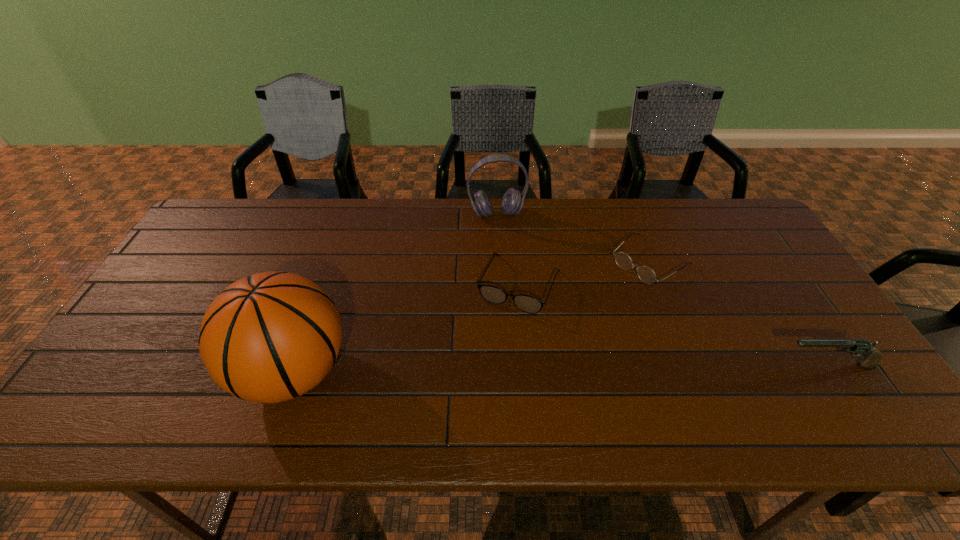
Locate an element on the screen. The image size is (960, 540). vacant space located aiming along the barrel of the third shortest object is located at coordinates (752, 365).

Find the location of a particular element. free space located 0.370m aiming along the barrel of the third shortest object is located at coordinates (627, 365).

This screenshot has width=960, height=540. Find the location of `vacant region located 0.110m aiming along the barrel of the third shortest object`. vacant region located 0.110m aiming along the barrel of the third shortest object is located at coordinates (734, 365).

Where is `vacant space located through the lenses of the right spectacles`? The height and width of the screenshot is (540, 960). vacant space located through the lenses of the right spectacles is located at coordinates (583, 314).

Where is `free spot located 0.120m through the lenses of the right spectacles`? This screenshot has width=960, height=540. free spot located 0.120m through the lenses of the right spectacles is located at coordinates (601, 300).

Where is `vacant area situated 0.400m through the lenses of the right spectacles`? The image size is (960, 540). vacant area situated 0.400m through the lenses of the right spectacles is located at coordinates (531, 356).

This screenshot has height=540, width=960. Identify the location of vacant region located 0.380m on the headband and ear cups of the farthest object. (520, 309).

The image size is (960, 540). I want to click on vacant space situated 0.340m on the headband and ear cups of the farthest object, so click(x=518, y=298).

The image size is (960, 540). Find the location of `vacant space located 0.150m on the headband and ear cups of the farthest object`. vacant space located 0.150m on the headband and ear cups of the farthest object is located at coordinates (508, 253).

This screenshot has width=960, height=540. Find the location of `free space located 0.170m on the front-facing side of the left spectacles`. free space located 0.170m on the front-facing side of the left spectacles is located at coordinates (484, 366).